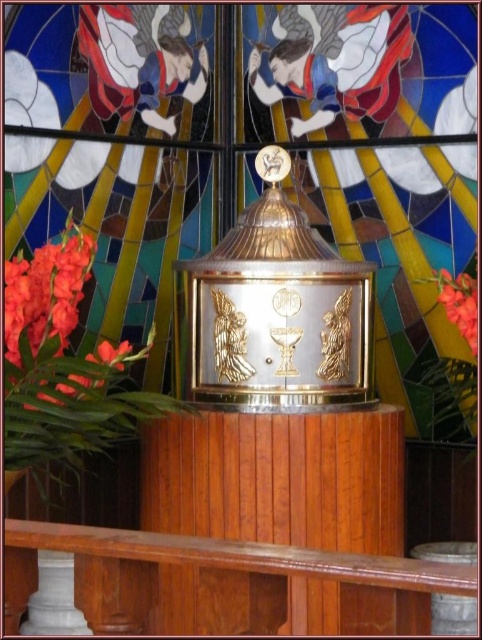
You are a visitor in the church and notice two flowers near the baptismal font. The matte orange flower at lower left and the matte red flower at right. Which flower is positioned more to the left side of the scene?

The matte orange flower at lower left is positioned more to the left side of the scene compared to the matte red flower at right.

You are a florist arranging flowers for a baptism ceremony. You have two flowers to place in the arrangement. The matte orange flower at lower left and the matte red flower at right. Which flower has a larger width?

The matte orange flower at lower left has a larger width than the matte red flower at right.

You are a maintenance worker who needs to clean the stained glass window at center and the matte orange flower at lower left. You have a 30 inch ladder. Can you reach both objects without moving the ladder?

The distance between the stained glass window at center and the matte orange flower at lower left is 30.98 inches. Since the ladder is only 30 inches long, it is slightly too short to cover the entire distance between them. Therefore, you would need to move the ladder to reach both objects.